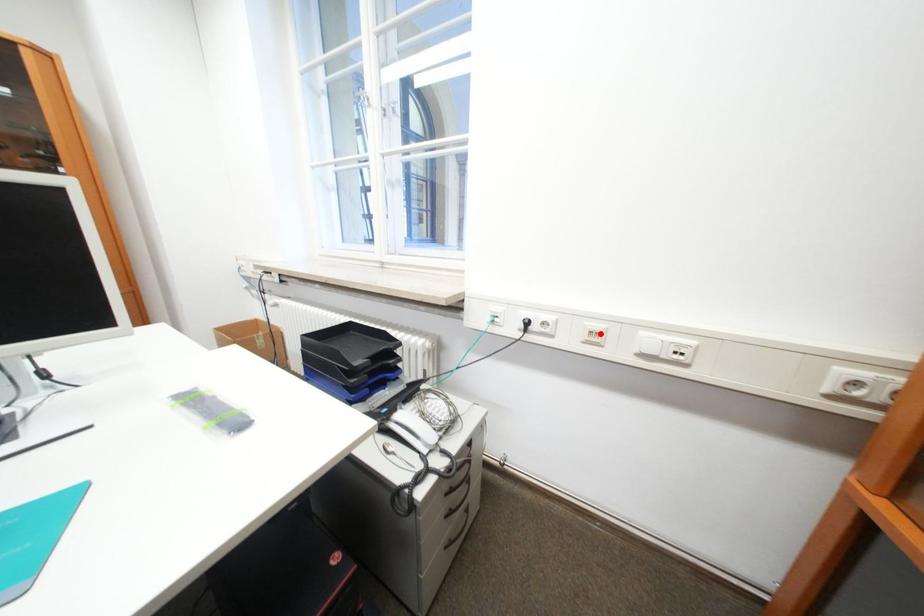
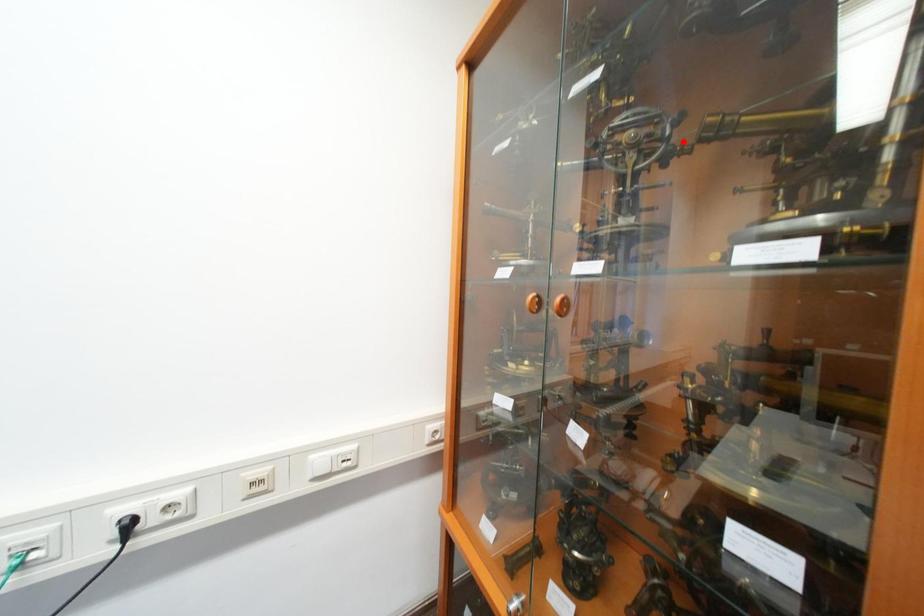
I am providing you with two images of the same scene from different viewpoints. A red point is marked on the first image and another point is marked on the second image. Is the marked point in image1 the same physical position as the marked point in image2?

No